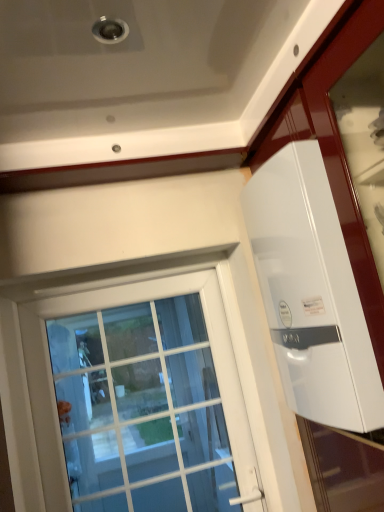
Measure the distance between point [204,291] and camera.

Point [204,291] is 5.74 feet from camera.

What do you see at coordinates (109, 358) in the screenshot? I see `white glass window at center` at bounding box center [109, 358].

You are a GUI agent. You are given a task and a screenshot of the screen. Output one action in this format:
    pyautogui.click(x=<x>, y=<y>)
    Task: Click on the white glass window at center
    
    Given the screenshot: What is the action you would take?
    pyautogui.click(x=109, y=358)

At what (x,y) coordinates should I click in order to perform the action: click on white glossy water heater at upper right. Please return your answer as a coordinate pair (x, y). Looking at the image, I should click on (311, 292).

Describe the element at coordinates (311, 292) in the screenshot. I see `white glossy water heater at upper right` at that location.

The width and height of the screenshot is (384, 512). I want to click on white glass window at center, so click(109, 358).

Does white glossy water heater at upper right appear on the right side of white glass window at center?

Yes, white glossy water heater at upper right is to the right of white glass window at center.

Is white glossy water heater at upper right behind white glass window at center?

No, it is not.

Is point (287, 282) closer to camera compared to point (230, 356)?

Yes.

From the image's perspective, is white glossy water heater at upper right above white glass window at center?

Yes.

Consider the image. From a real-world perspective, which is physically below, white glossy water heater at upper right or white glass window at center?

white glass window at center.

Considering the relative sizes of white glossy water heater at upper right and white glass window at center in the image provided, is white glossy water heater at upper right wider than white glass window at center?

Yes.

Is white glossy water heater at upper right shorter than white glass window at center?

Yes.

In terms of size, does white glossy water heater at upper right appear bigger or smaller than white glass window at center?

white glossy water heater at upper right is bigger than white glass window at center.

Is white glossy water heater at upper right located outside white glass window at center?

white glossy water heater at upper right is positioned outside white glass window at center.

Is white glossy water heater at upper right positioned far away from white glass window at center?

Indeed, white glossy water heater at upper right is not near white glass window at center.

Is white glossy water heater at upper right positioned with its back to white glass window at center?

white glossy water heater at upper right is not turned away from white glass window at center.

What's the angular difference between white glossy water heater at upper right and white glass window at center's facing directions?

They differ by 89.9 degrees in their facing directions.

Identify the location of appliance above the white glass window at center (from the image's perspective). pos(311,292).

Which is more to the right, white glass window at center or white glossy water heater at upper right?

Positioned to the right is white glossy water heater at upper right.

Considering their positions, is white glass window at center located in front of or behind white glossy water heater at upper right?

white glass window at center is behind white glossy water heater at upper right.

Does point (67, 442) come closer to viewer compared to point (351, 404)?

No, it is behind (351, 404).

From the image's perspective, which object appears higher, white glass window at center or white glossy water heater at upper right?

white glossy water heater at upper right appears higher in the image.

From a real-world perspective, is white glass window at center physically located above or below white glossy water heater at upper right?

In terms of real-world spatial position, white glass window at center is below white glossy water heater at upper right.

Consider the image. Which of these two, white glass window at center or white glossy water heater at upper right, is wider?

white glossy water heater at upper right is wider.

Does white glass window at center have a greater height compared to white glossy water heater at upper right?

Yes.

From the picture: Which of these two, white glass window at center or white glossy water heater at upper right, is bigger?

white glossy water heater at upper right.

Is white glass window at center positioned beyond the bounds of white glossy water heater at upper right?

Indeed, white glass window at center is completely outside white glossy water heater at upper right.

Are white glass window at center and white glossy water heater at upper right located far from each other?

Yes, white glass window at center and white glossy water heater at upper right are quite far apart.

In the scene shown: Could you tell me if white glass window at center is facing white glossy water heater at upper right?

No, white glass window at center is not facing towards white glossy water heater at upper right.

How different are the orientations of white glass window at center and white glossy water heater at upper right in degrees?

89.9 degrees.

Locate an element on the screen. Image resolution: width=384 pixels, height=512 pixels. window directly beneath the white glossy water heater at upper right (from a real-world perspective) is located at coordinates (109, 358).

The width and height of the screenshot is (384, 512). Find the location of `appliance that is above the white glass window at center (from a real-world perspective)`. appliance that is above the white glass window at center (from a real-world perspective) is located at coordinates (311, 292).

Where is `window below the white glossy water heater at upper right (from a real-world perspective)`? This screenshot has width=384, height=512. window below the white glossy water heater at upper right (from a real-world perspective) is located at coordinates (109, 358).